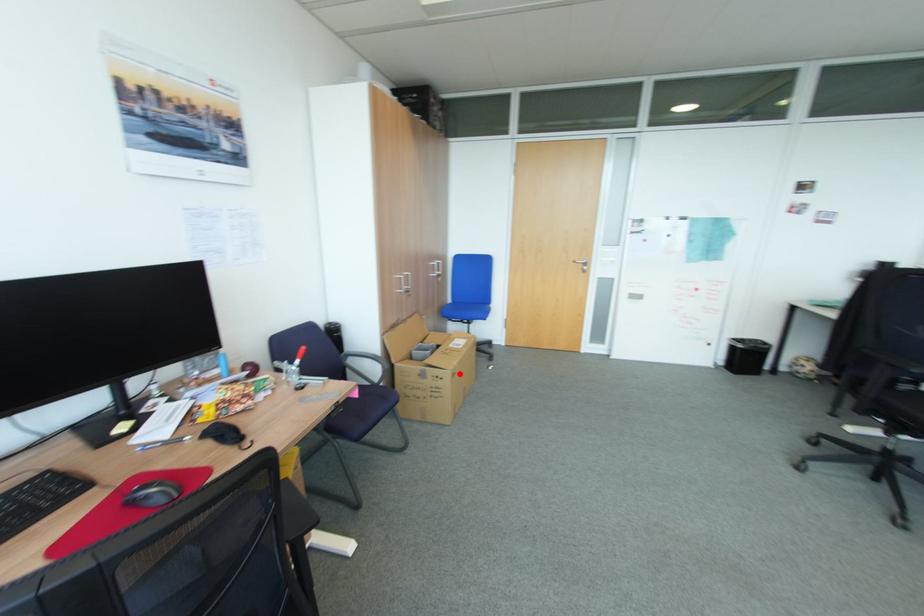
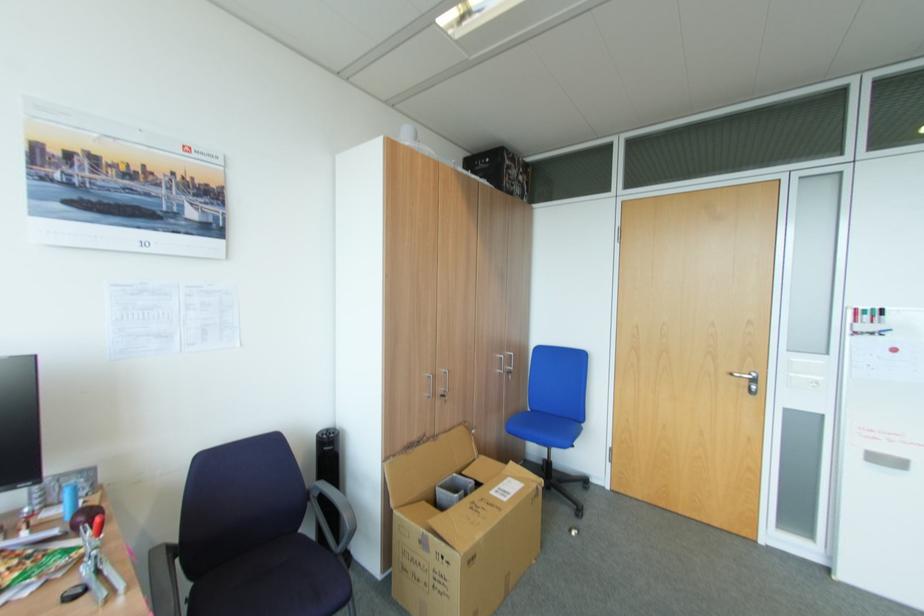
Where in the second image is the point corresponding to the highlighted location from the first image?

(479, 556)